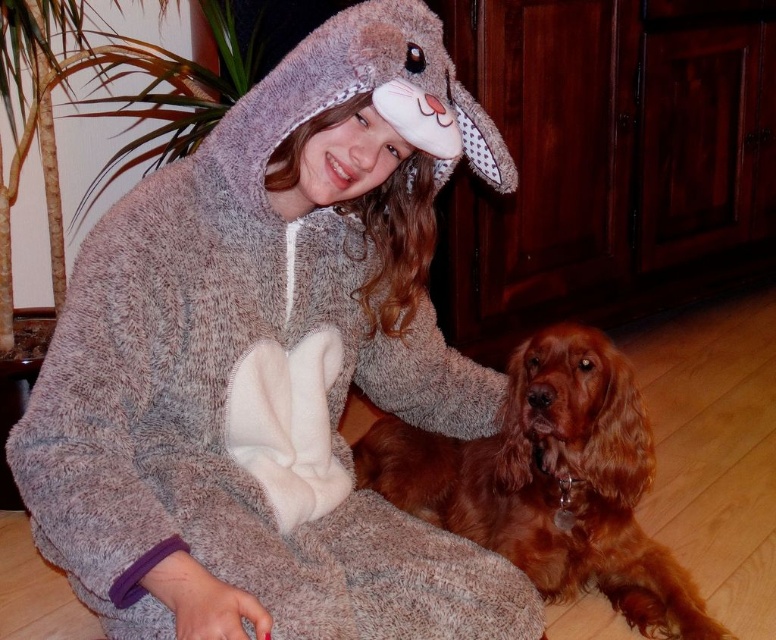
You are a delivery robot with a package that needs to be placed between the fluffy gray onesie at center and the brown furry dog at lower right. The package is 12 inches long. Will it fit in the space between them?

The fluffy gray onesie at center and brown furry dog at lower right are 13.17 inches apart. Since the package is 12 inches long, it will fit in the space between them as the distance is sufficient.

The girl is sitting on a wooden floor. Where exactly is the fluffy gray onesie at center located in relation to her position?

The fluffy gray onesie at center is located at the coordinates point (272,364) in relation to the girl.

You are a photographer trying to capture the girl in the rabbit outfit. You notice the fluffy gray onesie at center located at point (272, 364). Where should you position yourself to ensure the girl is centered in your shot while avoiding the onesie?

To center the girl while avoiding the fluffy gray onesie at center located at point (272, 364), position yourself slightly to the left or right of that point so the onesie doesn